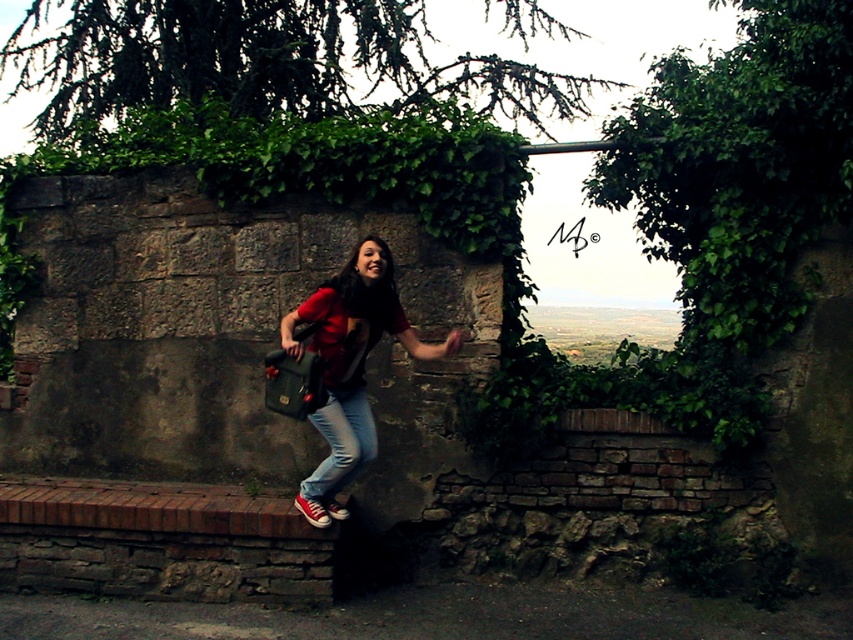
Is matte red shirt at center to the right of jeans at center from the viewer's perspective?

Indeed, matte red shirt at center is positioned on the right side of jeans at center.

Describe the element at coordinates (350, 368) in the screenshot. Image resolution: width=853 pixels, height=640 pixels. I see `matte red shirt at center` at that location.

Is point (297, 307) positioned after point (335, 460)?

Yes, point (297, 307) is behind point (335, 460).

Locate an element on the screen. matte red shirt at center is located at coordinates (350, 368).